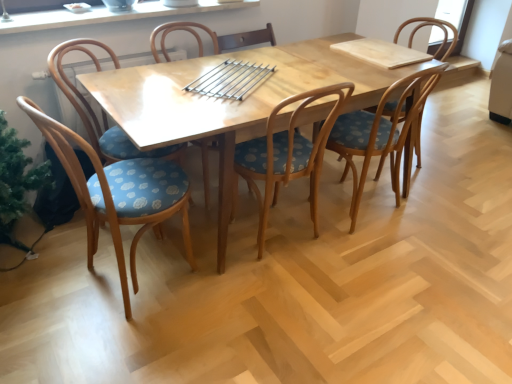
Question: From the image's perspective, is wooden chair with blue polka dot seat cushion at center, the 2th chair when ordered from right to left, located beneath wooden chair with blue polka dot seat at center, the 4th chair from the right?

Choices:
 (A) yes
 (B) no

Answer: (A)

Question: Does wooden chair with blue polka dot seat cushion at center, the 2th chair when ordered from right to left, have a greater height compared to wooden chair with blue polka dot seat at center, which is counted as the third chair, starting from the left?

Choices:
 (A) no
 (B) yes

Answer: (A)

Question: From the image's perspective, is wooden chair with blue polka dot seat cushion at center, which is counted as the 5th chair, starting from the left, located above wooden chair with blue polka dot seat at center, the 4th chair from the right?

Choices:
 (A) no
 (B) yes

Answer: (A)

Question: Could wooden chair with blue polka dot seat at center, which is counted as the third chair, starting from the left, be considered to be inside wooden chair with blue polka dot seat cushion at center, which is counted as the 5th chair, starting from the left?

Choices:
 (A) no
 (B) yes

Answer: (A)

Question: Can you confirm if wooden chair with blue polka dot seat cushion at center, the 2th chair when ordered from right to left, is positioned to the left of wooden chair with blue polka dot seat at center, the 4th chair from the right?

Choices:
 (A) no
 (B) yes

Answer: (A)

Question: From a real-world perspective, relative to white glossy window sill at upper center, is natural wood table at center vertically above or below?

Choices:
 (A) below
 (B) above

Answer: (A)

Question: Is natural wood table at center wider or thinner than white glossy window sill at upper center?

Choices:
 (A) wide
 (B) thin

Answer: (A)

Question: Relative to white glossy window sill at upper center, is natural wood table at center in front or behind?

Choices:
 (A) front
 (B) behind

Answer: (A)

Question: Does point (305, 54) appear closer or farther from the camera than point (18, 31)?

Choices:
 (A) closer
 (B) farther

Answer: (B)

Question: In the image, is wooden chair with blue polka dot seat cushion at center, which is counted as the 5th chair, starting from the left, positioned in front of or behind wooden chair with blue polka dot seat at center, the 4th chair from the right?

Choices:
 (A) behind
 (B) front

Answer: (B)

Question: Considering the positions of wooden chair with blue polka dot seat cushion at center, the 2th chair when ordered from right to left, and wooden chair with blue polka dot seat at center, the 4th chair from the right, in the image, is wooden chair with blue polka dot seat cushion at center, the 2th chair when ordered from right to left, bigger or smaller than wooden chair with blue polka dot seat at center, the 4th chair from the right,?

Choices:
 (A) small
 (B) big

Answer: (B)

Question: Which is correct: wooden chair with blue polka dot seat cushion at center, which is counted as the 5th chair, starting from the left, is inside wooden chair with blue polka dot seat at center, the 4th chair from the right, or outside of it?

Choices:
 (A) inside
 (B) outside

Answer: (B)

Question: Is wooden chair with blue polka dot seat cushion at center, the 2th chair when ordered from right to left, wider or thinner than wooden chair with blue polka dot seat at center, which is counted as the third chair, starting from the left?

Choices:
 (A) thin
 (B) wide

Answer: (A)

Question: Is blue polka dot wood chair at left, which appears as the fifth chair when viewed from the right, inside or outside of natural wood table at center?

Choices:
 (A) inside
 (B) outside

Answer: (A)

Question: Relative to natural wood table at center, is blue polka dot wood chair at left, which appears as the fifth chair when viewed from the right, in front or behind?

Choices:
 (A) front
 (B) behind

Answer: (A)